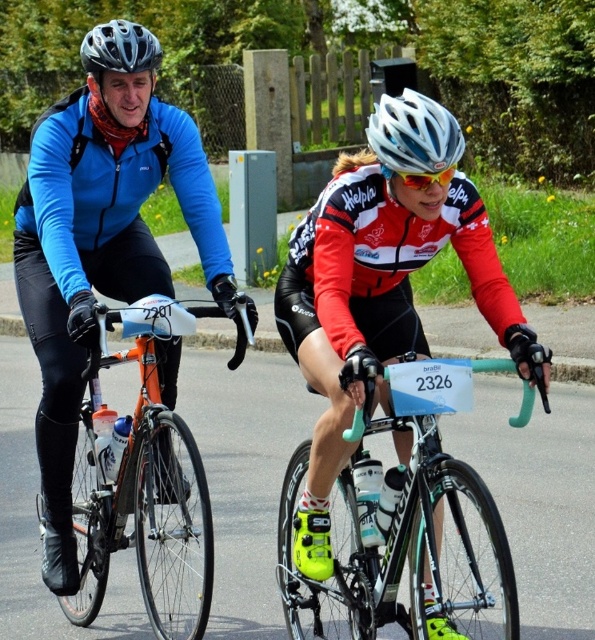
Which is below, orange matte bicycle at left or matte black helmet at upper left?

orange matte bicycle at left is below.

Who is positioned more to the left, orange matte bicycle at left or matte black helmet at upper left?

matte black helmet at upper left is more to the left.

This screenshot has width=595, height=640. I want to click on orange matte bicycle at left, so pos(142,483).

Find the location of `orange matte bicycle at left`. orange matte bicycle at left is located at coordinates (142, 483).

Does teal glossy bicycle at center have a lesser height compared to orange matte bicycle at left?

Indeed, teal glossy bicycle at center has a lesser height compared to orange matte bicycle at left.

Based on the photo, who is shorter, teal glossy bicycle at center or orange matte bicycle at left?

teal glossy bicycle at center

Is point (425, 420) positioned behind point (193, 557)?

No, (425, 420) is in front of (193, 557).

At what (x,y) coordinates should I click in order to perform the action: click on teal glossy bicycle at center. Please return your answer as a coordinate pair (x, y). Image resolution: width=595 pixels, height=640 pixels. Looking at the image, I should click on (397, 508).

Can you confirm if orange matte bicycle at left is bigger than white matte bicycle helmet at center?

Yes.

Who is higher up, orange matte bicycle at left or white matte bicycle helmet at center?

white matte bicycle helmet at center is higher up.

The width and height of the screenshot is (595, 640). What are the coordinates of `orange matte bicycle at left` in the screenshot? It's located at (142, 483).